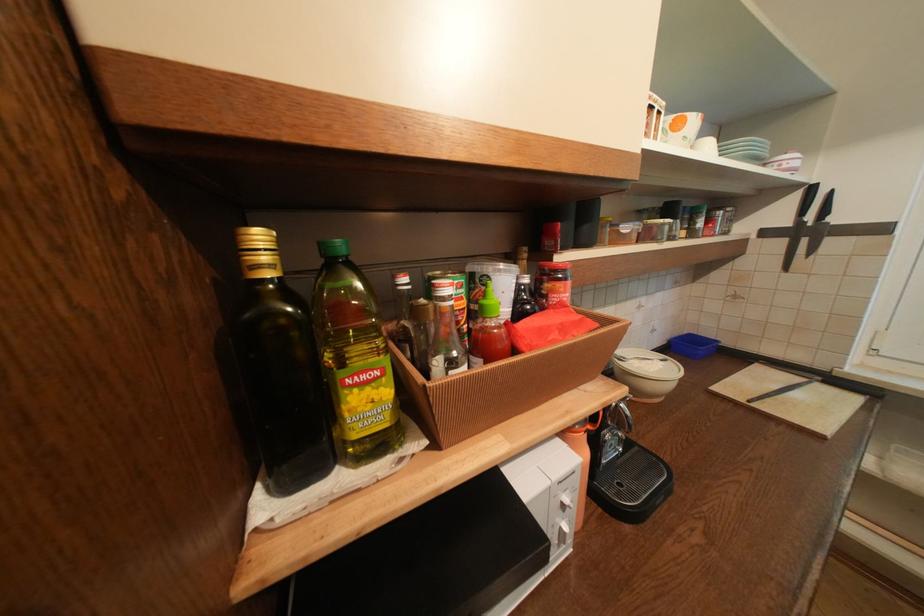
Image resolution: width=924 pixels, height=616 pixels. I want to click on gold bottle cap, so click(x=258, y=253).